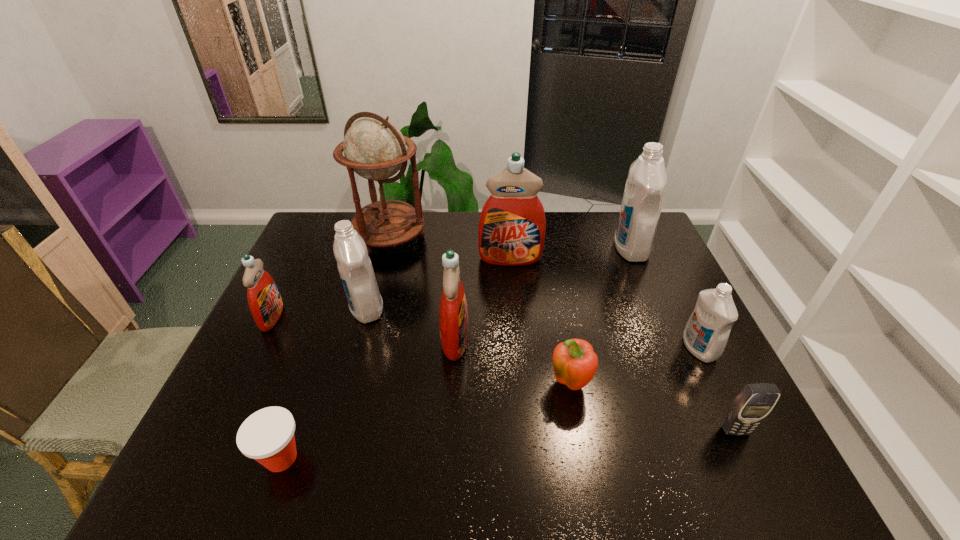
At what (x,y) coordinates should I click in order to perform the action: click on vacant space that's between the farthest red detergent and the third nearest object. Please return your answer as a coordinate pair (x, y). Image resolution: width=960 pixels, height=540 pixels. Looking at the image, I should click on [540, 322].

Find the location of `vacant space that's between the nearest white detergent and the rightmost red detergent`. vacant space that's between the nearest white detergent and the rightmost red detergent is located at coordinates (605, 303).

Where is `vacant area that lies between the third nearest object and the nearest white detergent`? The image size is (960, 540). vacant area that lies between the third nearest object and the nearest white detergent is located at coordinates (634, 367).

This screenshot has height=540, width=960. In order to click on vacant space that is in between the farthest red detergent and the second nearest white detergent in this screenshot , I will do `click(439, 283)`.

The height and width of the screenshot is (540, 960). I want to click on vacant area that lies between the third detergent from right to left and the nearest white detergent, so click(x=605, y=303).

Locate an element on the screen. The height and width of the screenshot is (540, 960). vacant space that's between the tallest object and the second detergent from left to right is located at coordinates (377, 273).

This screenshot has height=540, width=960. I want to click on vacant area that lies between the leftmost red detergent and the sixth object from right to left, so click(x=364, y=328).

Locate an element on the screen. The width and height of the screenshot is (960, 540). empty space that is in between the second biggest white detergent and the third nearest object is located at coordinates (468, 347).

Identify the location of free spot between the farthest white detergent and the smallest white detergent. (665, 299).

Point out which object is positioned as the ninth nearest to the Dixie cup. Please provide its 2D coordinates. Your answer should be formatted as a tuple, i.e. [(x, y)], where the tuple contains the x and y coordinates of a point satisfying the conditions above.

[(644, 191)]